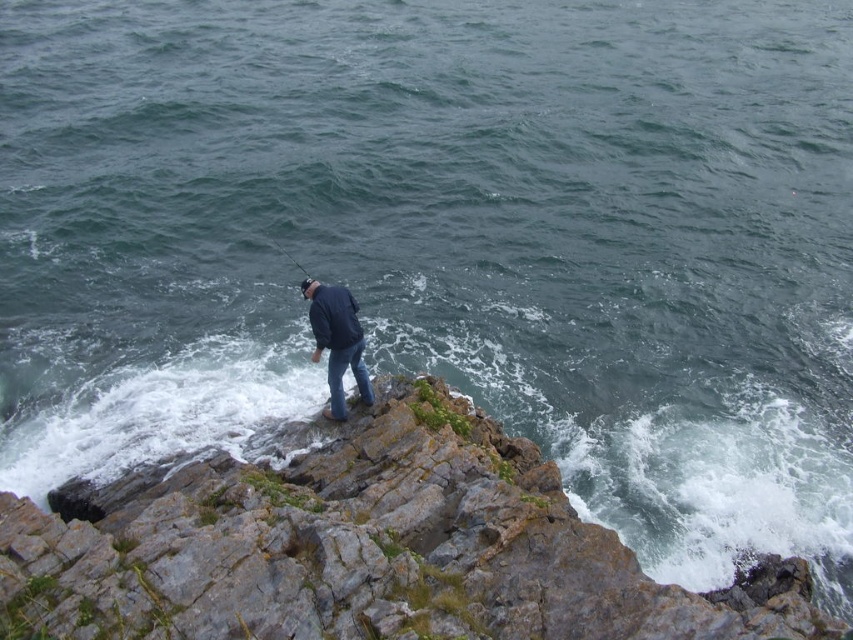
Consider the image. You are a drone operator tasked with capturing aerial footage of the gray rocky cliff at center. Your drone has a maximum flight range of 7 meters. Can the drone safely capture footage from the cliff without exceeding its range?

The gray rocky cliff at center is 7.23 meters away from the camera. Since the drone can only fly up to 7 meters, it cannot safely capture footage from the cliff without exceeding its range.

You are a safety inspector evaluating the fishing location. The safety guideline states that the minimum safe distance between a fisherman and the edge of a cliff should be at least 5 meters. Based on the image, is the dark blue jacket at center positioned safely relative to the gray rocky cliff at center?

The distance between the gray rocky cliff at center and the dark blue jacket at center is 4.62 meters, which is less than the required 5 meters. Therefore, the dark blue jacket at center is not positioned safely relative to the gray rocky cliff at center.

You are a photographer trying to capture the fisherman holding the fishing rod. Based on the scene, which object is closer to the camera between the dark blue jacket at center and the smooth black rod at center?

The dark blue jacket at center is positioned under the smooth black rod at center, meaning the smooth black rod at center is closer to the camera.